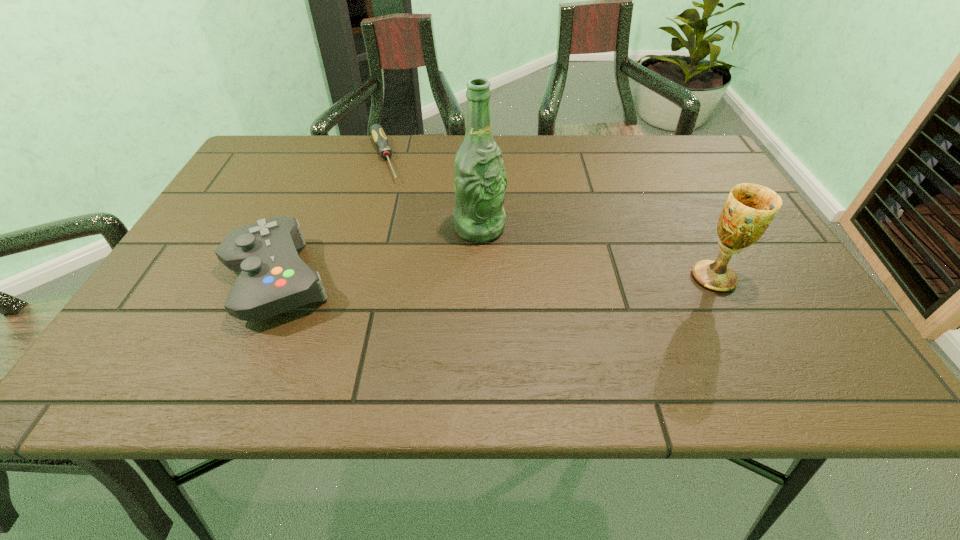
You are a GUI agent. You are given a task and a screenshot of the screen. Output one action in this format:
    pyautogui.click(x=<x>, y=<y>)
    Task: Click on the free spot on the desktop that is between the third tallest object and the third shortest object and is positioned on the surface of the third object from left to right
    Image resolution: width=960 pixels, height=540 pixels.
    Given the screenshot: What is the action you would take?
    pyautogui.click(x=537, y=279)

This screenshot has width=960, height=540. In order to click on free space on the desktop that is between the control and the chalice and is positioned insert the shortest object into a screw head in this screenshot , I will do [433, 280].